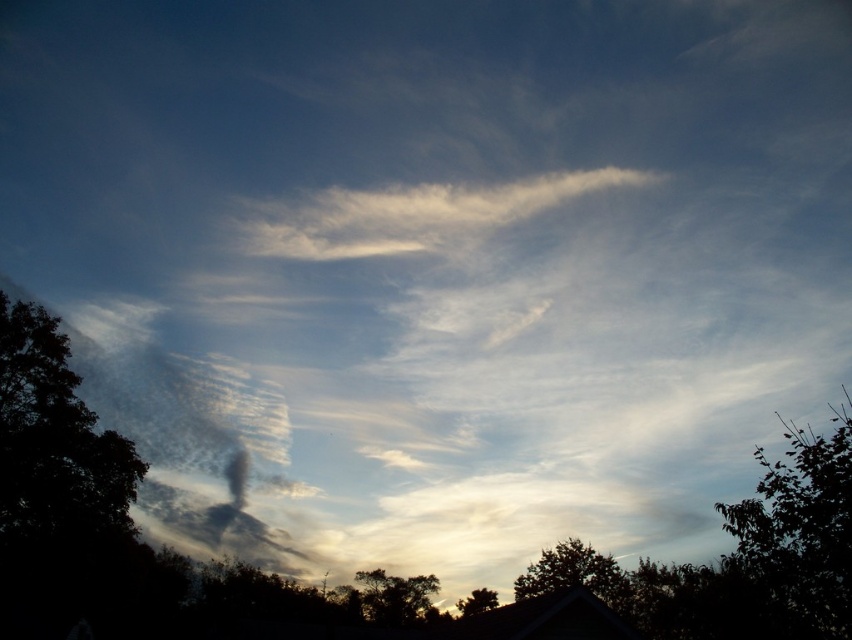
You are an artist trying to paint this scene. You want to ensure the silvery gray foliage at right and the silvery gray tree at lower center are proportionally accurate. Which one should you paint wider?

The silvery gray foliage at right should be painted wider because its width is larger than the silvery gray tree at lower center.

You are standing at the center of the image and want to look at the dark green leafy tree at left. In which direction should you turn your head?

The dark green leafy tree at left is positioned at point 0.761 on the x axis and 0.067 on the y axis. Since the x coordinate is less than 1, it is to the left of the center. Therefore, you should turn your head to the left to look at the dark green leafy tree at left.